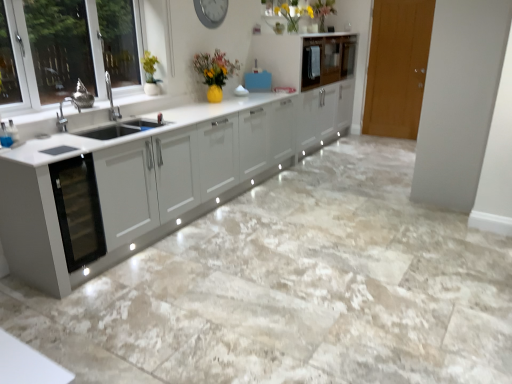
Question: Is wooden door at right located within glossy white cabinet at upper center, which is the second cabinetry in front-to-back order?

Choices:
 (A) no
 (B) yes

Answer: (A)

Question: From the image's perspective, would you say glossy white cabinet at upper center, which is the 1th cabinetry from back to front, is positioned over wooden door at right?

Choices:
 (A) no
 (B) yes

Answer: (B)

Question: Considering the relative sizes of glossy white cabinet at upper center, which is the second cabinetry in front-to-back order, and wooden door at right in the image provided, is glossy white cabinet at upper center, which is the second cabinetry in front-to-back order, taller than wooden door at right?

Choices:
 (A) no
 (B) yes

Answer: (A)

Question: Is glossy white cabinet at upper center, which is the 1th cabinetry from back to front, to the left of wooden door at right from the viewer's perspective?

Choices:
 (A) no
 (B) yes

Answer: (B)

Question: Is glossy white cabinet at upper center, which is the second cabinetry in front-to-back order, wider than wooden door at right?

Choices:
 (A) no
 (B) yes

Answer: (B)

Question: From a real-world perspective, is glossy white cabinet at upper center, which is the second cabinetry in front-to-back order, beneath wooden door at right?

Choices:
 (A) yes
 (B) no

Answer: (B)

Question: Is glossy white cabinet at upper center, which is the 1th cabinetry from back to front, closer to the viewer compared to metallic gray clock at upper center?

Choices:
 (A) no
 (B) yes

Answer: (A)

Question: Is glossy white cabinet at upper center, which is the second cabinetry in front-to-back order, bigger than metallic gray clock at upper center?

Choices:
 (A) no
 (B) yes

Answer: (B)

Question: Considering the relative sizes of glossy white cabinet at upper center, which is the 1th cabinetry from back to front, and metallic gray clock at upper center in the image provided, is glossy white cabinet at upper center, which is the 1th cabinetry from back to front, wider than metallic gray clock at upper center?

Choices:
 (A) yes
 (B) no

Answer: (A)

Question: Is glossy white cabinet at upper center, which is the 1th cabinetry from back to front, completely or partially outside of metallic gray clock at upper center?

Choices:
 (A) yes
 (B) no

Answer: (A)

Question: From the image's perspective, is glossy white cabinet at upper center, which is the second cabinetry in front-to-back order, beneath metallic gray clock at upper center?

Choices:
 (A) yes
 (B) no

Answer: (B)

Question: From the image's perspective, is glossy white cabinet at upper center, which is the 1th cabinetry from back to front, located above metallic gray clock at upper center?

Choices:
 (A) no
 (B) yes

Answer: (B)

Question: Is the depth of matte yellow vase at upper center greater than that of metallic gray clock at upper center?

Choices:
 (A) no
 (B) yes

Answer: (B)